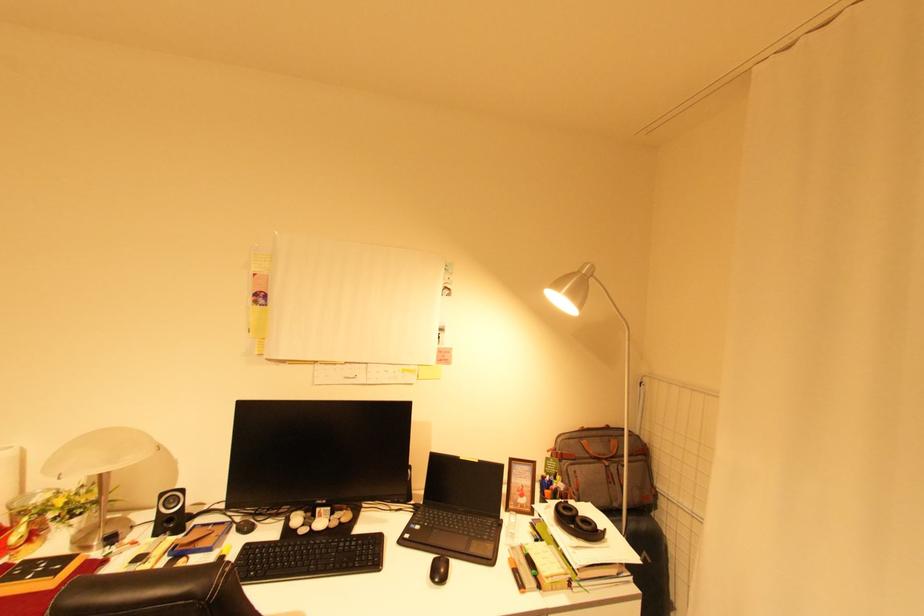
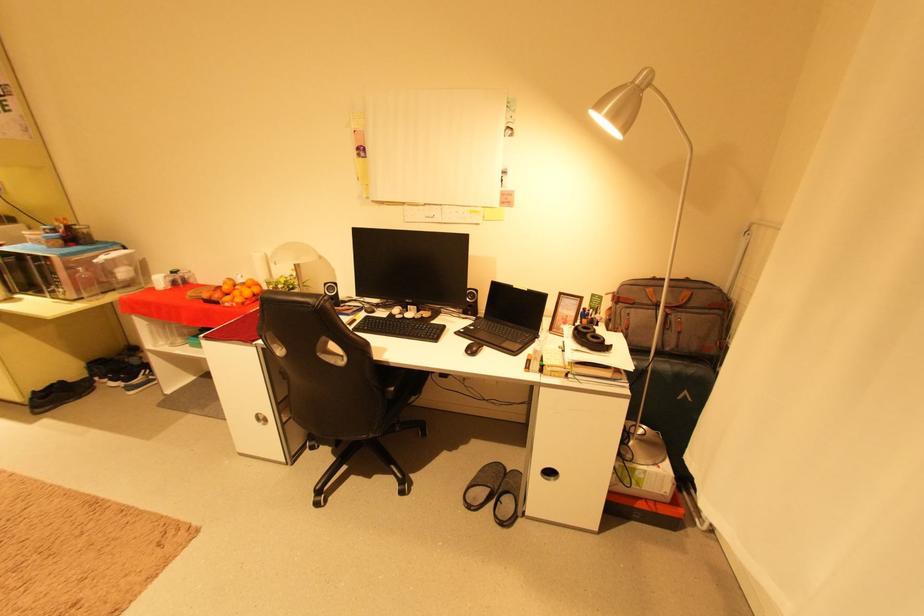
In the second image, find the point that corresponds to [615,439] in the first image.

(688, 290)